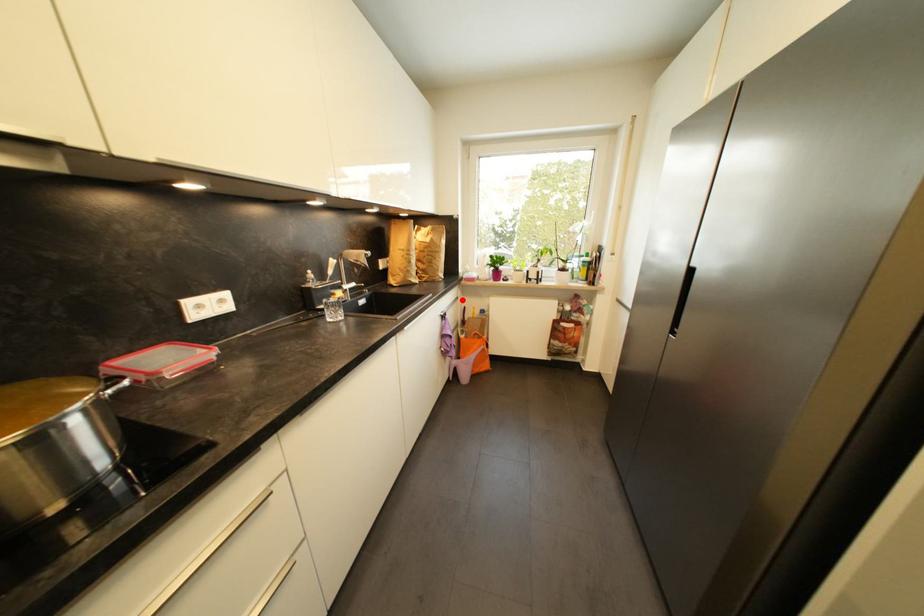
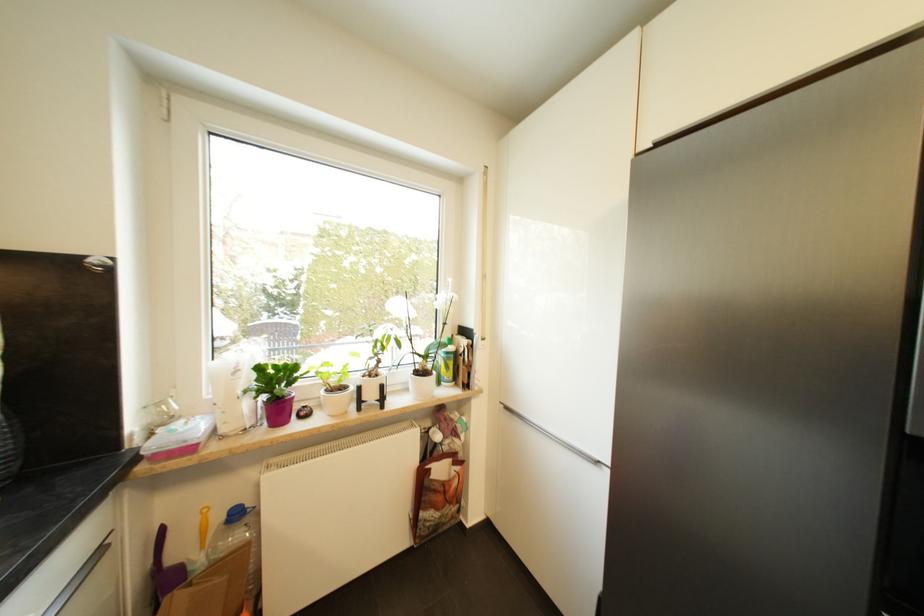
Question: I am providing you with two images of the same scene from different viewpoints. In image1, a red point is highlighted. Considering the same 3D point in image2, which of the following is correct?

Choices:
 (A) It is closer
 (B) It is farther

Answer: (B)